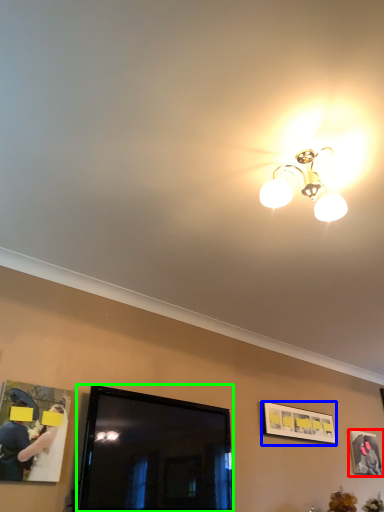
Question: Which object is the closest to the picture frame (highlighted by a red box)? Choose among these: picture frame (highlighted by a blue box) or television (highlighted by a green box).

Choices:
 (A) picture frame
 (B) television

Answer: (A)